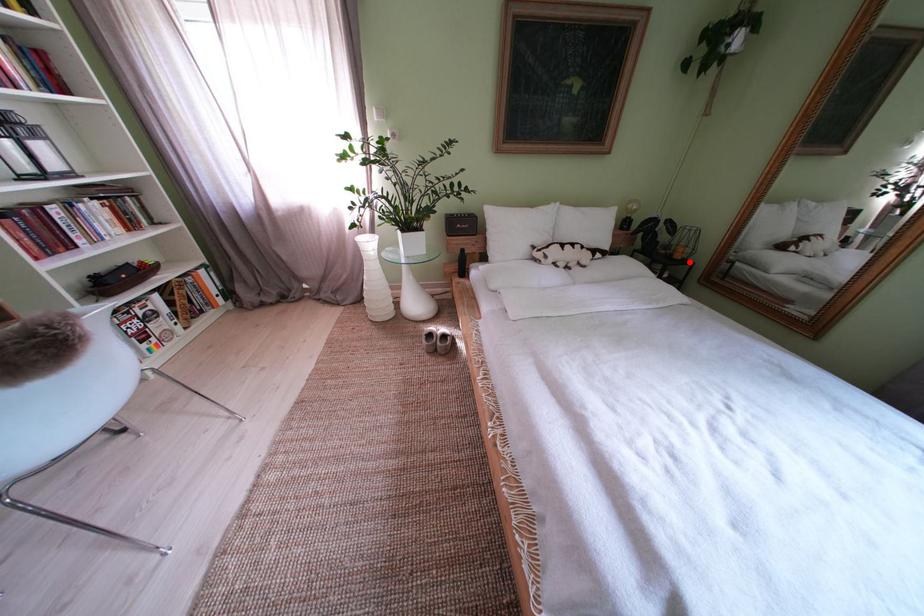
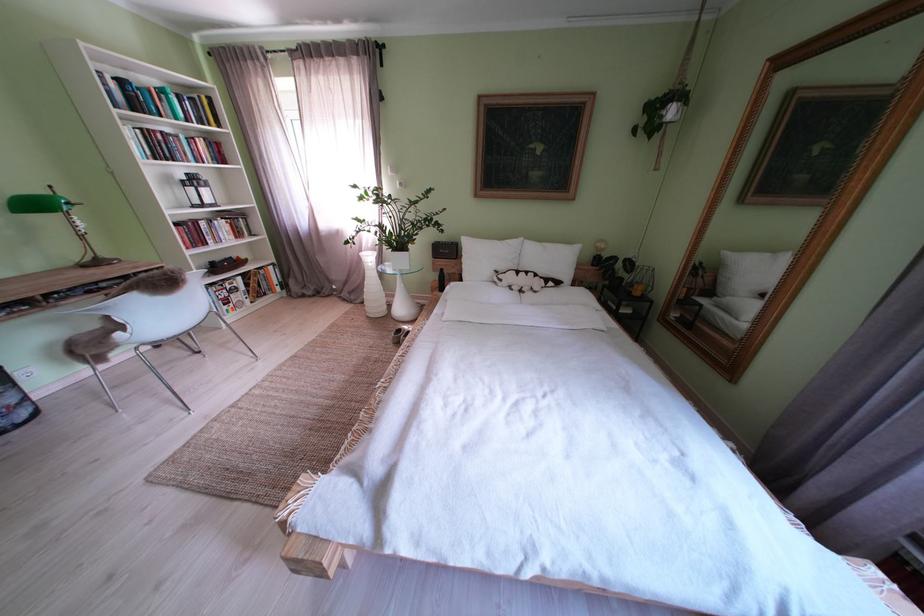
Question: I am providing you with two images of the same scene from different viewpoints. A red point is shown in image1. For the corresponding object point in image2, is it positioned nearer or farther from the camera?

Choices:
 (A) Nearer
 (B) Farther

Answer: (A)